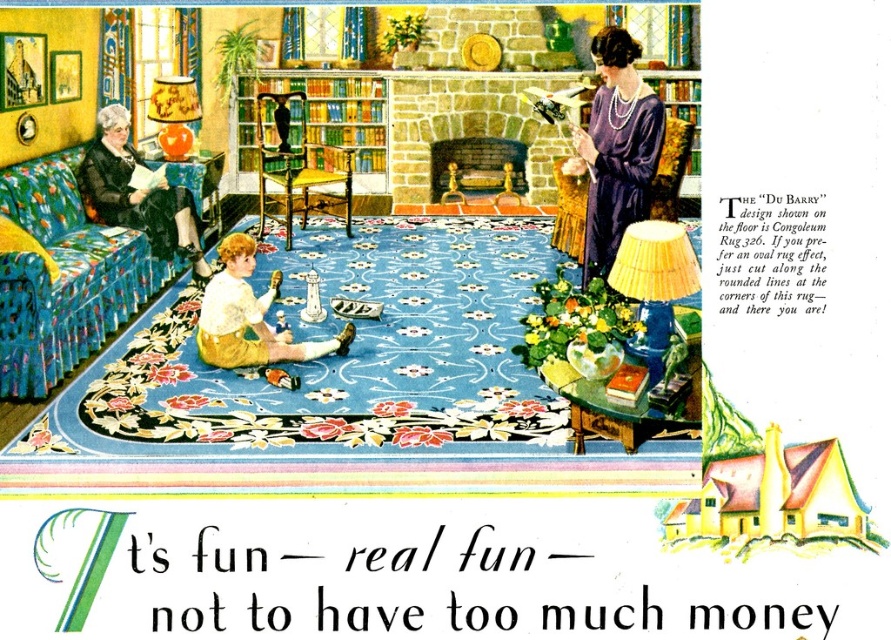
Between floral fabric couch at left and yellow cotton dress at center, which one has less height?

With less height is yellow cotton dress at center.

Can you confirm if floral fabric couch at left is smaller than yellow cotton dress at center?

No.

Find the location of a particular element. floral fabric couch at left is located at coordinates (64, 276).

From the picture: Who is higher up, yellow cotton dress at center or orange fabric lampshade at upper left?

orange fabric lampshade at upper left is higher up.

Which is more to the left, yellow cotton dress at center or orange fabric lampshade at upper left?

From the viewer's perspective, orange fabric lampshade at upper left appears more on the left side.

What do you see at coordinates (249, 316) in the screenshot? I see `yellow cotton dress at center` at bounding box center [249, 316].

Find the location of a particular element. Image resolution: width=891 pixels, height=640 pixels. yellow cotton dress at center is located at coordinates (249, 316).

From the picture: Does floral fabric couch at left appear on the left side of yellow painted wood house at center?

Correct, you'll find floral fabric couch at left to the left of yellow painted wood house at center.

Who is lower down, floral fabric couch at left or yellow painted wood house at center?

Positioned lower is yellow painted wood house at center.

What do you see at coordinates (64, 276) in the screenshot? This screenshot has height=640, width=891. I see `floral fabric couch at left` at bounding box center [64, 276].

The height and width of the screenshot is (640, 891). Find the location of `floral fabric couch at left`. floral fabric couch at left is located at coordinates (64, 276).